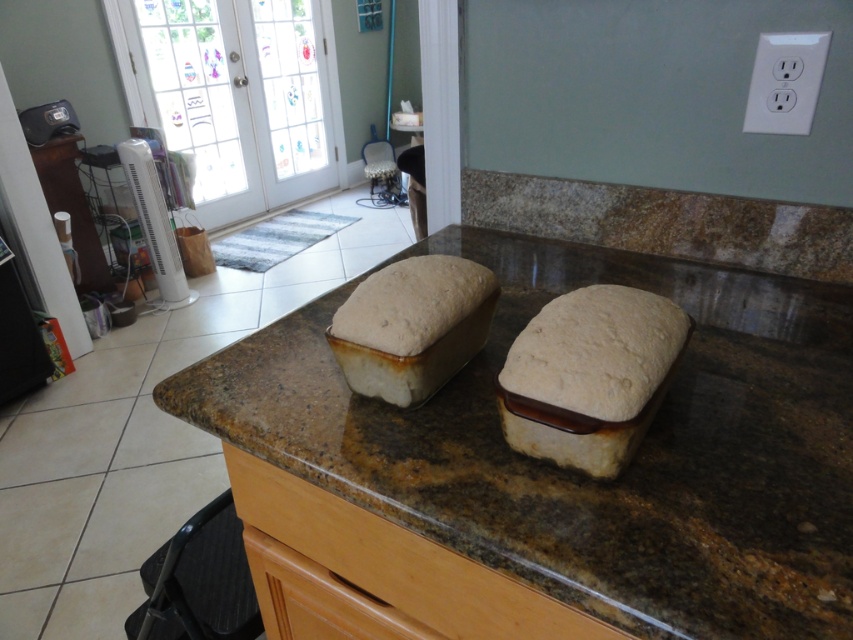
What is located at the point with coordinates (590, 376) in the image?

The point at coordinates (590, 376) is located on spongy white bread at center.

You are standing in the kitchen and want to place a small bowl of herbs on the brown granite countertop at center. The bowl is 10 cm in diameter. Can you place it at the point with coordinates point (561, 468)?

The point point (561, 468) is on the brown granite countertop at center, so yes, you can place the bowl there.

You are a chef preparing to place a heavy mixing bowl on the brown granite countertop at center. However, you notice the wooden drawer at center below it. Should you be concerned about the drawer being damaged by the weight?

The brown granite countertop at center is positioned over the wooden drawer at center. Since the countertop is likely supported by the structure beneath it, placing the mixing bowl on the countertop shouldn generated any direct pressure on the drawer itself. Therefore, there is no need to worry about damaging the wooden drawer at center.